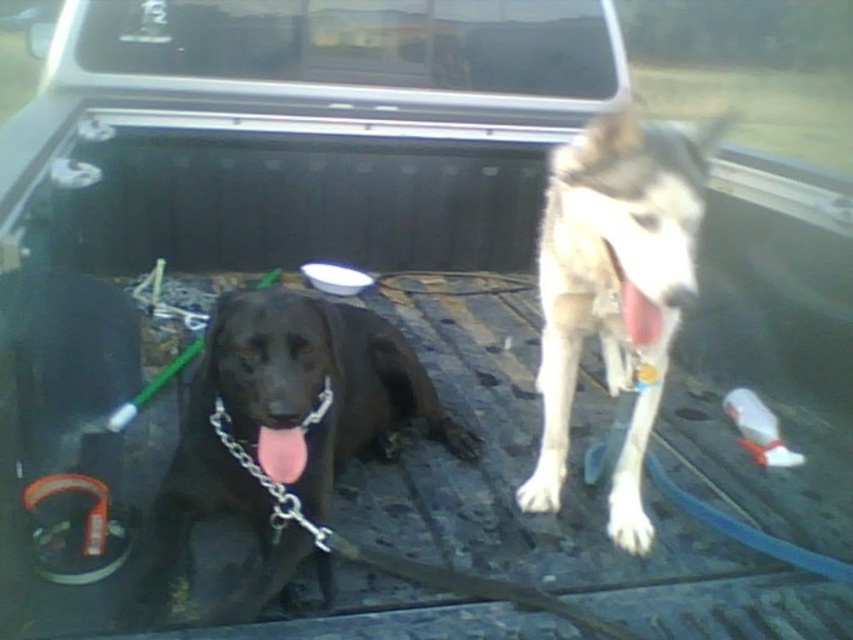
Question: Which of the following is the farthest from the observer?

Choices:
 (A) white fur dog at center
 (B) shiny black dog at center

Answer: (B)

Question: Which of the following is the farthest from the observer?

Choices:
 (A) white fur dog at center
 (B) shiny black dog at center

Answer: (B)

Question: Which object is closer to the camera taking this photo?

Choices:
 (A) shiny black dog at center
 (B) white fur dog at center

Answer: (B)

Question: Does shiny black dog at center appear under white fur dog at center?

Choices:
 (A) yes
 (B) no

Answer: (A)

Question: Considering the relative positions of shiny black dog at center and white fur dog at center in the image provided, where is shiny black dog at center located with respect to white fur dog at center?

Choices:
 (A) right
 (B) left

Answer: (B)

Question: Is shiny black dog at center bigger than white fur dog at center?

Choices:
 (A) yes
 (B) no

Answer: (B)